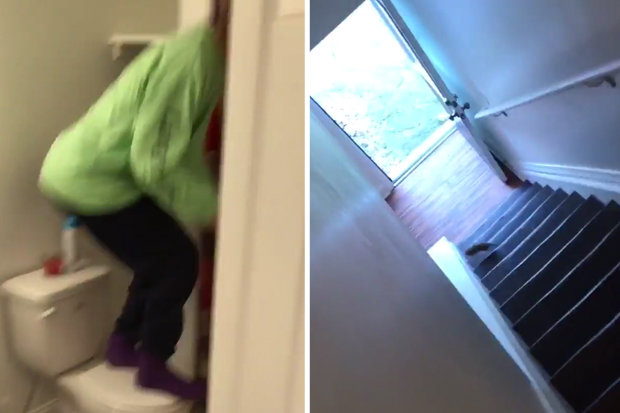
At what (x,y) coordinates should I click in order to perform the action: click on air freshener. Please return your answer as a coordinate pair (x, y). Looking at the image, I should click on (69, 241).